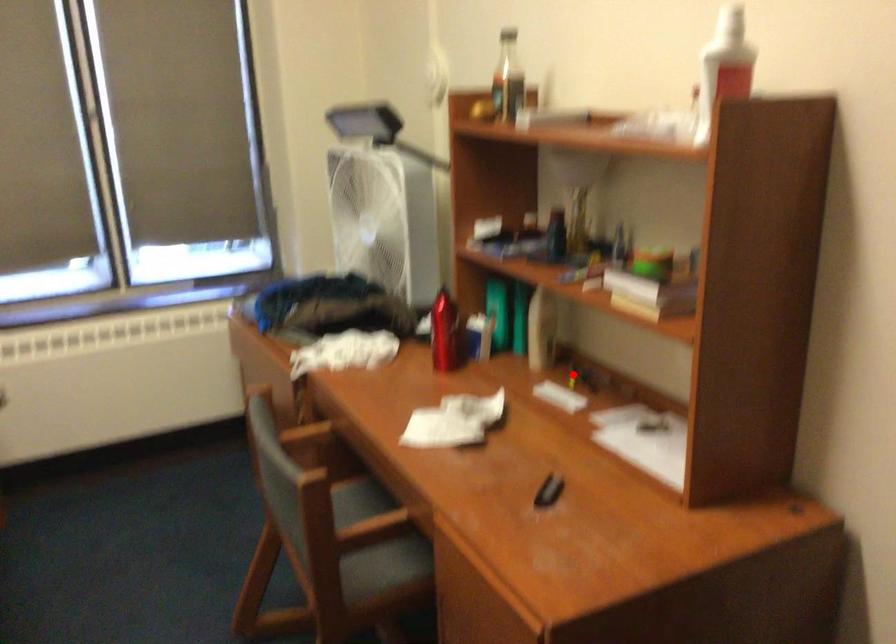
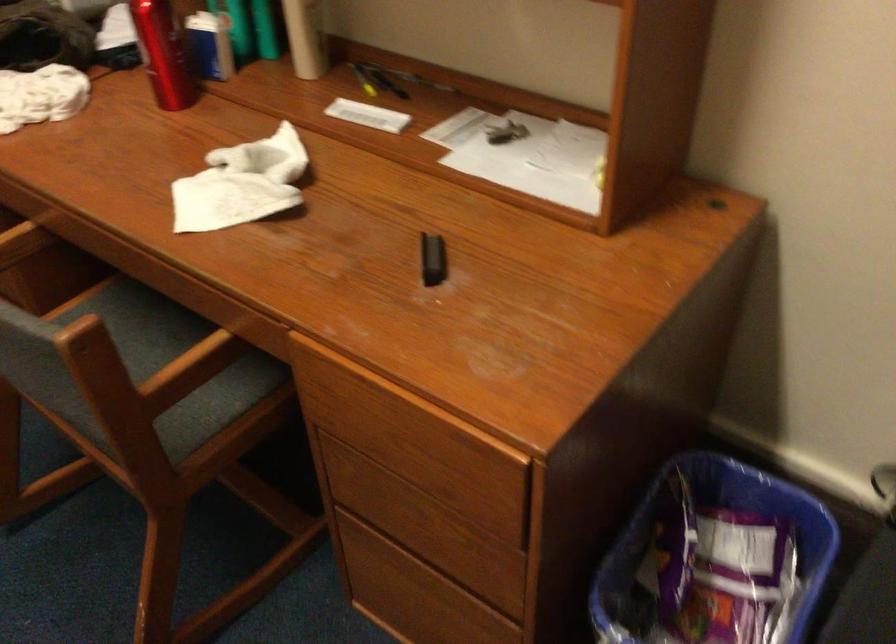
The point at the highlighted location is marked in the first image. Where is the corresponding point in the second image?

(363, 80)